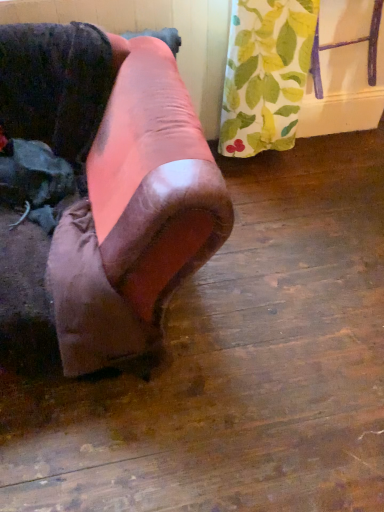
What is the approximate width of green leaf-patterned curtain at upper right, which appears as the 1th furniture when viewed from the top?

green leaf-patterned curtain at upper right, which appears as the 1th furniture when viewed from the top, is 8.44 inches in width.

Describe the element at coordinates (347, 45) in the screenshot. The height and width of the screenshot is (512, 384). I see `green leaf-patterned curtain at upper right, which appears as the 1th furniture when viewed from the top` at that location.

In order to face green leaf-patterned curtain at upper right, which appears as the 1th furniture when viewed from the top, should I rotate leftwards or rightwards?

To face it directly, rotate right by 19.707 degrees.

Locate an element on the screen. This screenshot has height=512, width=384. green leaf-patterned curtain at upper right, which appears as the 1th furniture when viewed from the top is located at coordinates (347, 45).

Identify the location of leather couch at left, acting as the second furniture starting from the right. The image size is (384, 512). (132, 186).

Image resolution: width=384 pixels, height=512 pixels. What do you see at coordinates (132, 186) in the screenshot? I see `leather couch at left, marked as the 2th furniture in a top-to-bottom arrangement` at bounding box center [132, 186].

The width and height of the screenshot is (384, 512). I want to click on green leaf-patterned curtain at upper right, the second furniture ordered from the bottom, so click(x=347, y=45).

Would you say green leaf-patterned curtain at upper right, the second furniture ordered from the bottom, is to the left or to the right of leather couch at left, which is the 1th furniture in left-to-right order, in the picture?

green leaf-patterned curtain at upper right, the second furniture ordered from the bottom, is positioned on leather couch at left, which is the 1th furniture in left-to-right order,'s right side.

Is green leaf-patterned curtain at upper right, the second furniture ordered from the bottom, further to camera compared to leather couch at left, acting as the second furniture starting from the right?

Yes, the depth of green leaf-patterned curtain at upper right, the second furniture ordered from the bottom, is greater than that of leather couch at left, acting as the second furniture starting from the right.

Is point (338, 42) positioned before point (43, 24)?

No, (338, 42) is further to viewer.

From the image's perspective, is green leaf-patterned curtain at upper right, the second furniture ordered from the bottom, above or below leather couch at left, acting as the second furniture starting from the right?

green leaf-patterned curtain at upper right, the second furniture ordered from the bottom, is above leather couch at left, acting as the second furniture starting from the right.

From a real-world perspective, is green leaf-patterned curtain at upper right, the second furniture ordered from the bottom, physically located above or below leather couch at left, which appears as the first furniture when ordered from the bottom?

In terms of real-world spatial position, green leaf-patterned curtain at upper right, the second furniture ordered from the bottom, is above leather couch at left, which appears as the first furniture when ordered from the bottom.

Which of these two, green leaf-patterned curtain at upper right, which is the 2th furniture in left-to-right order, or leather couch at left, acting as the second furniture starting from the right, is wider?

With larger width is leather couch at left, acting as the second furniture starting from the right.

Does green leaf-patterned curtain at upper right, acting as the 1th furniture starting from the right, have a greater height compared to leather couch at left, which appears as the first furniture when ordered from the bottom?

In fact, green leaf-patterned curtain at upper right, acting as the 1th furniture starting from the right, may be shorter than leather couch at left, which appears as the first furniture when ordered from the bottom.

Does green leaf-patterned curtain at upper right, which appears as the 1th furniture when viewed from the top, have a larger size compared to leather couch at left, which is the 1th furniture in left-to-right order?

Actually, green leaf-patterned curtain at upper right, which appears as the 1th furniture when viewed from the top, might be smaller than leather couch at left, which is the 1th furniture in left-to-right order.

Is green leaf-patterned curtain at upper right, acting as the 1th furniture starting from the right, completely or partially outside of leather couch at left, acting as the second furniture starting from the right?

green leaf-patterned curtain at upper right, acting as the 1th furniture starting from the right, is positioned outside leather couch at left, acting as the second furniture starting from the right.

Is there a large distance between green leaf-patterned curtain at upper right, which is the 2th furniture in left-to-right order, and leather couch at left, which is the 1th furniture in left-to-right order?

Yes, green leaf-patterned curtain at upper right, which is the 2th furniture in left-to-right order, and leather couch at left, which is the 1th furniture in left-to-right order, are quite far apart.

Is green leaf-patterned curtain at upper right, the second furniture ordered from the bottom, positioned with its back to leather couch at left, marked as the 2th furniture in a top-to-bottom arrangement?

→ green leaf-patterned curtain at upper right, the second furniture ordered from the bottom, is not turned away from leather couch at left, marked as the 2th furniture in a top-to-bottom arrangement.

Can you tell me how much green leaf-patterned curtain at upper right, acting as the 1th furniture starting from the right, and leather couch at left, marked as the 2th furniture in a top-to-bottom arrangement, differ in facing direction?

The angular difference between green leaf-patterned curtain at upper right, acting as the 1th furniture starting from the right, and leather couch at left, marked as the 2th furniture in a top-to-bottom arrangement, is 2.25 degrees.

How distant is green leaf-patterned curtain at upper right, acting as the 1th furniture starting from the right, from leather couch at left, which appears as the first furniture when ordered from the bottom?

A distance of 3.82 feet exists between green leaf-patterned curtain at upper right, acting as the 1th furniture starting from the right, and leather couch at left, which appears as the first furniture when ordered from the bottom.

The width and height of the screenshot is (384, 512). What are the coordinates of `furniture that is on the right side of leather couch at left, acting as the second furniture starting from the right` in the screenshot? It's located at (347, 45).

Is leather couch at left, marked as the 2th furniture in a top-to-bottom arrangement, to the left or to the right of green leaf-patterned curtain at upper right, which is the 2th furniture in left-to-right order, in the image?

leather couch at left, marked as the 2th furniture in a top-to-bottom arrangement, is to the left of green leaf-patterned curtain at upper right, which is the 2th furniture in left-to-right order.

In the image, is leather couch at left, which appears as the first furniture when ordered from the bottom, positioned in front of or behind green leaf-patterned curtain at upper right, which is the 2th furniture in left-to-right order?

leather couch at left, which appears as the first furniture when ordered from the bottom, is positioned closer to the viewer than green leaf-patterned curtain at upper right, which is the 2th furniture in left-to-right order.

Considering the positions of point (214, 196) and point (317, 33), is point (214, 196) closer or farther from the camera than point (317, 33)?

Point (214, 196) appears to be closer to the viewer than point (317, 33).

Looking at this image, from the image's perspective, who appears lower, leather couch at left, marked as the 2th furniture in a top-to-bottom arrangement, or green leaf-patterned curtain at upper right, which is the 2th furniture in left-to-right order?

leather couch at left, marked as the 2th furniture in a top-to-bottom arrangement, is shown below in the image.

In the scene shown: From a real-world perspective, is leather couch at left, marked as the 2th furniture in a top-to-bottom arrangement, physically below green leaf-patterned curtain at upper right, the second furniture ordered from the bottom?

Yes.

Can you confirm if leather couch at left, which appears as the first furniture when ordered from the bottom, is thinner than green leaf-patterned curtain at upper right, which appears as the 1th furniture when viewed from the top?

No, leather couch at left, which appears as the first furniture when ordered from the bottom, is not thinner than green leaf-patterned curtain at upper right, which appears as the 1th furniture when viewed from the top.

Is leather couch at left, acting as the second furniture starting from the right, shorter than green leaf-patterned curtain at upper right, which is the 2th furniture in left-to-right order?

No, leather couch at left, acting as the second furniture starting from the right, is not shorter than green leaf-patterned curtain at upper right, which is the 2th furniture in left-to-right order.

Which of these two, leather couch at left, acting as the second furniture starting from the right, or green leaf-patterned curtain at upper right, which appears as the 1th furniture when viewed from the top, is bigger?

With larger size is leather couch at left, acting as the second furniture starting from the right.

From the picture: Is leather couch at left, acting as the second furniture starting from the right, situated inside green leaf-patterned curtain at upper right, which appears as the 1th furniture when viewed from the top, or outside?

The correct answer is: outside.

Is leather couch at left, marked as the 2th furniture in a top-to-bottom arrangement, with green leaf-patterned curtain at upper right, the second furniture ordered from the bottom?

They are not placed beside each other.

Is leather couch at left, marked as the 2th furniture in a top-to-bottom arrangement, looking in the opposite direction of green leaf-patterned curtain at upper right, which is the 2th furniture in left-to-right order?

No, green leaf-patterned curtain at upper right, which is the 2th furniture in left-to-right order, is not at the back of leather couch at left, marked as the 2th furniture in a top-to-bottom arrangement.

How many degrees apart are the facing directions of leather couch at left, acting as the second furniture starting from the right, and green leaf-patterned curtain at upper right, the second furniture ordered from the bottom?

The angular difference between leather couch at left, acting as the second furniture starting from the right, and green leaf-patterned curtain at upper right, the second furniture ordered from the bottom, is 2.25 degrees.

Where is `furniture on the right of leather couch at left, marked as the 2th furniture in a top-to-bottom arrangement`? furniture on the right of leather couch at left, marked as the 2th furniture in a top-to-bottom arrangement is located at coordinates (347, 45).

At what (x,y) coordinates should I click in order to perform the action: click on furniture lying below the green leaf-patterned curtain at upper right, the second furniture ordered from the bottom (from the image's perspective). Please return your answer as a coordinate pair (x, y). Looking at the image, I should click on (132, 186).

At what (x,y) coordinates should I click in order to perform the action: click on furniture above the leather couch at left, which appears as the first furniture when ordered from the bottom (from the image's perspective). Please return your answer as a coordinate pair (x, y). The image size is (384, 512). Looking at the image, I should click on (347, 45).